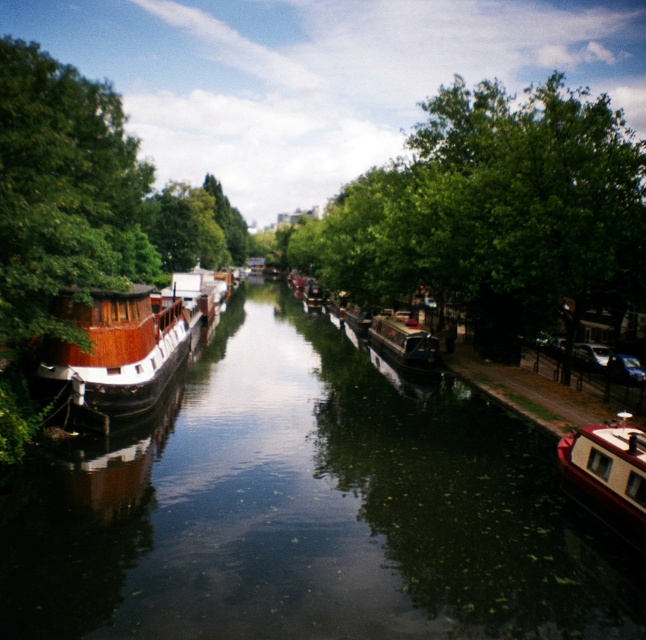
You are a photographer planning to capture a wide shot of the wooden canal boat at left and the green leafy tree at center. Based on their widths, which object should you position closer to the camera to ensure both fit within the frame?

The wooden canal boat at left is thinner than the green leafy tree at center, so you should position the wooden canal boat at left closer to the camera to ensure both fit within the frame.

You are standing at the edge of the canal and see two points marked in the scene. The first point is at coordinates point (136, 340) and the second is at point (599, 502). Which point is closer to you?

Point (136, 340) is closer to you because it is further to the viewer than point (599, 502).

You are standing at the edge of the canal and want to locate the green leafy tree at center. According to the coordinates provided, where would you look relative to your position?

The green leafy tree at center is located at coordinates point [495,214], which means it is positioned approximately one third of the way from the left edge and three fourths from the bottom of the image.